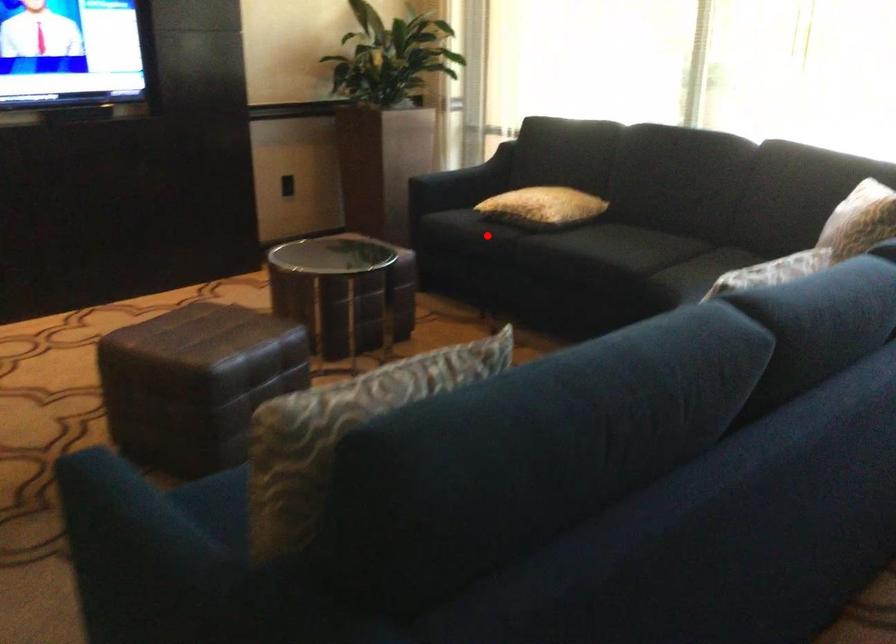
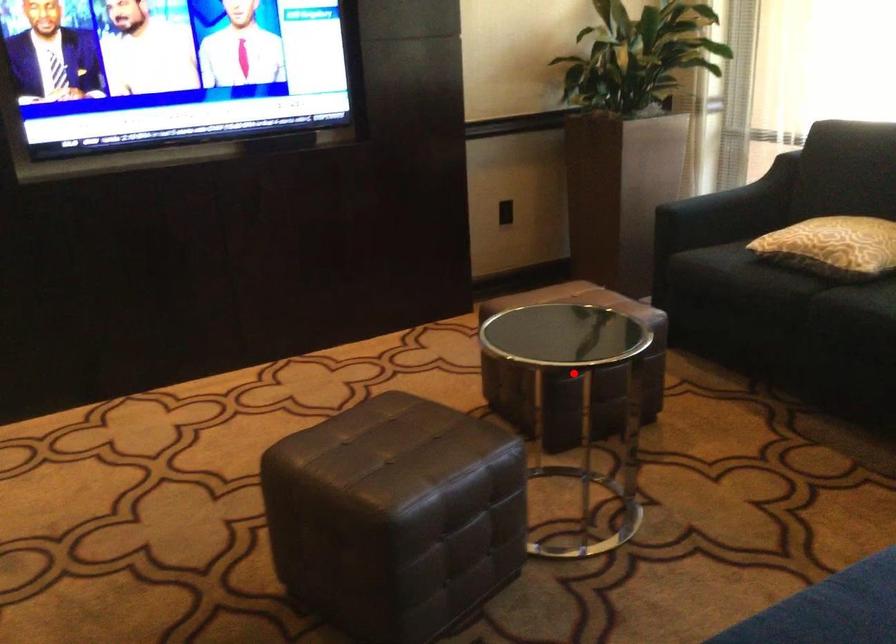
I am providing you with two images of the same scene from different viewpoints. A red point is marked on the first image and another point is marked on the second image. Is the marked point in image1 the same physical position as the marked point in image2?

No